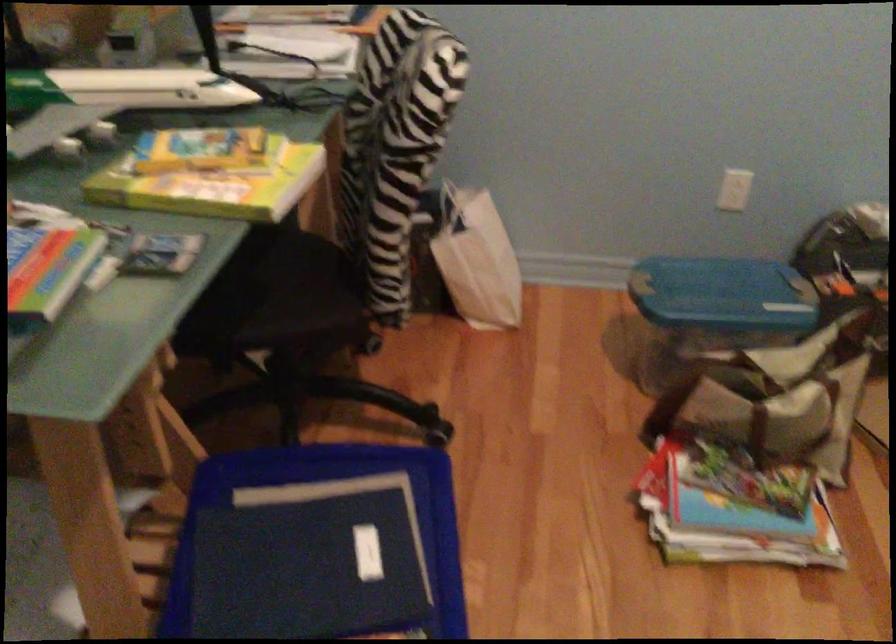
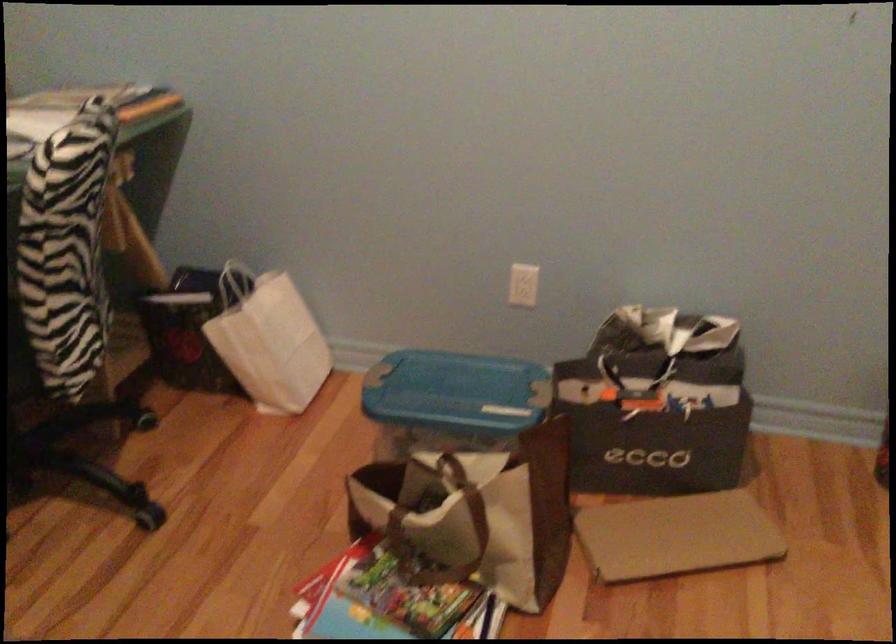
Question: Based on the continuous images, in which direction is the camera rotating? Reply with the corresponding letter.

Choices:
 (A) Left
 (B) Right
 (C) Up
 (D) Down

Answer: (A)